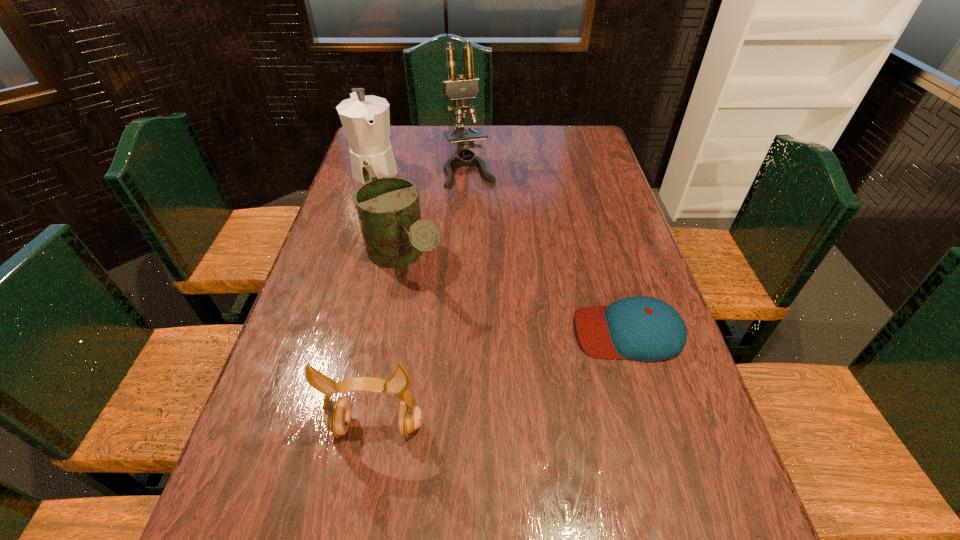
Locate an element on the screen. free space on the desktop that is between the nearest object and the shortest object and is positioned with the spout on the watering can is located at coordinates (495, 382).

Find the location of a particular element. Image resolution: width=960 pixels, height=540 pixels. free spot on the desktop that is between the nearest object and the rightmost object and is positioned at the spout of the second tallest object is located at coordinates (487, 385).

Identify the location of free space on the desktop that is between the earphone and the baseball cap and is positioned at the eyepieces of the microscope. The image size is (960, 540). pos(543,363).